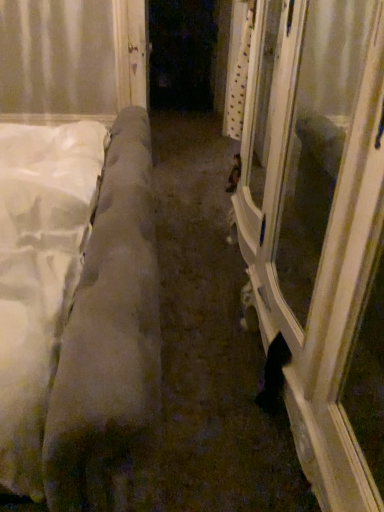
Question: From a real-world perspective, is white soft mattress at left on top of white glossy door at center?

Choices:
 (A) yes
 (B) no

Answer: (B)

Question: Is white soft mattress at left positioned beyond the bounds of white glossy door at center?

Choices:
 (A) no
 (B) yes

Answer: (B)

Question: Does white soft mattress at left appear on the left side of white glossy door at center?

Choices:
 (A) yes
 (B) no

Answer: (A)

Question: From the image's perspective, is white soft mattress at left under white glossy door at center?

Choices:
 (A) yes
 (B) no

Answer: (A)

Question: Is white soft mattress at left facing towards white glossy door at center?

Choices:
 (A) yes
 (B) no

Answer: (B)

Question: Is white soft mattress at left shorter than white glossy door at center?

Choices:
 (A) yes
 (B) no

Answer: (B)

Question: Can you confirm if white glossy door at center is smaller than white glossy door at center?

Choices:
 (A) no
 (B) yes

Answer: (A)

Question: From the image's perspective, is white glossy door at center above white glossy door at center?

Choices:
 (A) no
 (B) yes

Answer: (A)

Question: Does white glossy door at center have a greater height compared to white glossy door at center?

Choices:
 (A) yes
 (B) no

Answer: (B)

Question: Is white glossy door at center in contact with white glossy door at center?

Choices:
 (A) no
 (B) yes

Answer: (A)

Question: Would you say white glossy door at center is outside white glossy door at center?

Choices:
 (A) yes
 (B) no

Answer: (A)

Question: Is white glossy door at center at the back of white glossy door at center?

Choices:
 (A) no
 (B) yes

Answer: (A)

Question: Is white soft mattress at left taller than white glossy door at center?

Choices:
 (A) yes
 (B) no

Answer: (A)